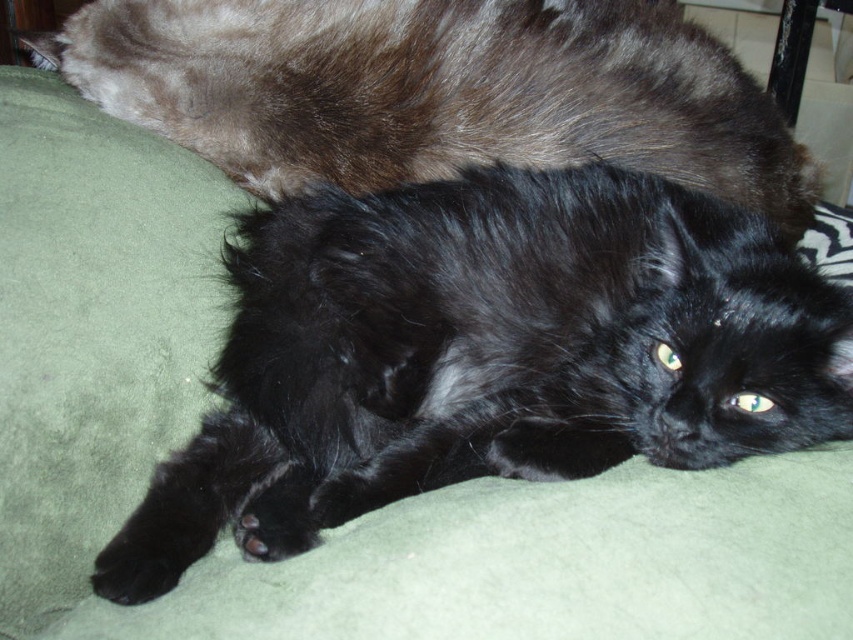
You are a photographer trying to capture both cats in a portrait. Given that the black fluffy cat at center is taller than the black fluffy cat at upper center, which cat should you focus on to ensure the taller one is in the foreground?

You should focus on the black fluffy cat at center because it is taller than the black fluffy cat at upper center, so placing it in the foreground will highlight its size.

You are a cat owner who wants to buy a new bed for your cats. The bed you chose is designed to accommodate two cats of different sizes. You see the black fluffy cat at center and the black fluffy cat at upper center in the image. Which cat requires a larger portion of the bed?

The black fluffy cat at upper center requires a larger portion of the bed because it is bigger in size compared to the black fluffy cat at center.

You are standing in front of a green cushioned surface where two cats are resting. You notice a point marked at coordinates (486, 355). What is located at that exact point?

At point (486, 355) lies the black fluffy cat at center.